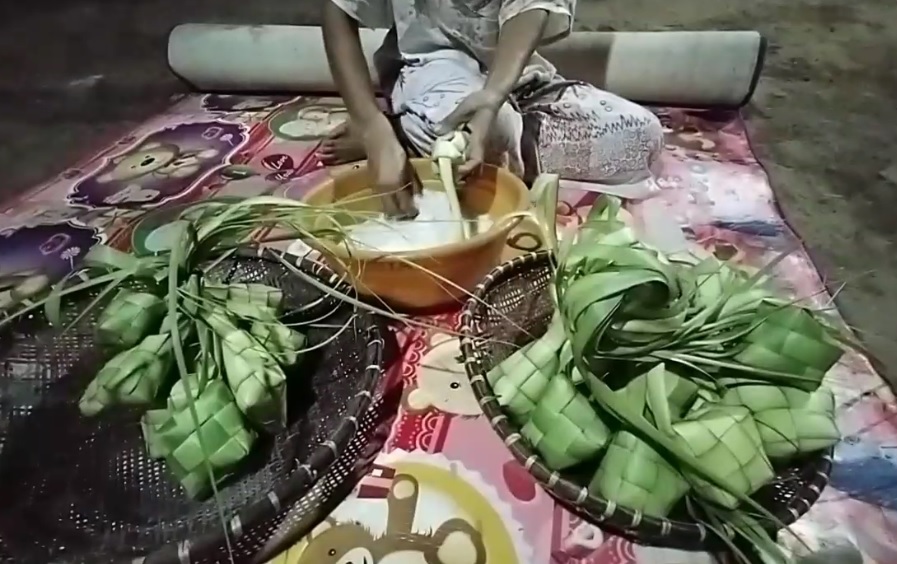
This screenshot has width=897, height=564. Find the location of `flat baskets`. flat baskets is located at coordinates (308, 460), (476, 358).